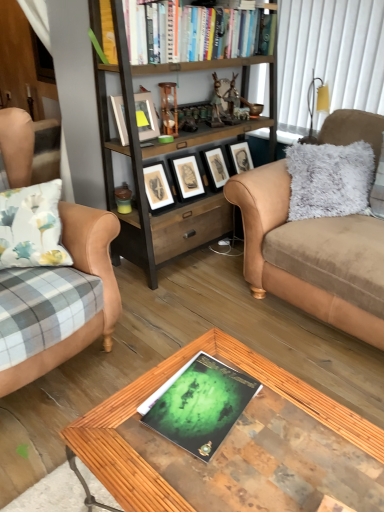
I want to click on free spot above wooden glass coffee table at center (from a real-world perspective), so click(238, 422).